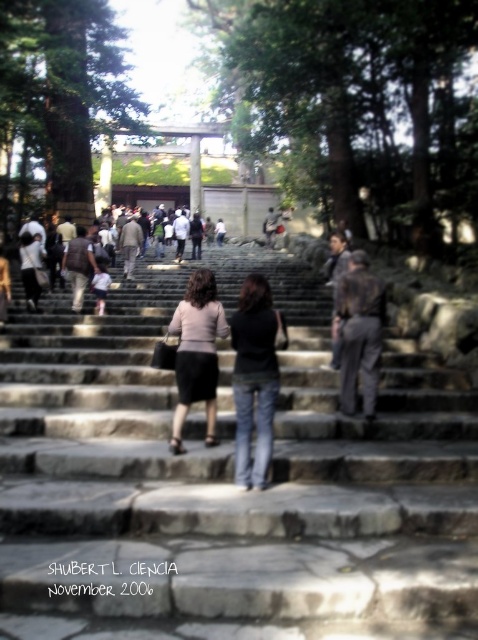
Question: Among these objects, which one is nearest to the camera?

Choices:
 (A) dark gray suit at center
 (B) gray stone stairs at center

Answer: (B)

Question: From the image, what is the correct spatial relationship of gray stone stairs at center in relation to dark gray suit at center?

Choices:
 (A) below
 (B) above

Answer: (A)

Question: Among these objects, which one is nearest to the camera?

Choices:
 (A) matte pink sweater at center
 (B) black denim jeans at center

Answer: (B)

Question: Does matte pink sweater at center have a lesser width compared to dark gray suit at center?

Choices:
 (A) no
 (B) yes

Answer: (A)

Question: Which point is closer to the camera?

Choices:
 (A) matte pink sweater at center
 (B) dark gray suit at center

Answer: (A)

Question: Is gray stone stairs at center to the right of dark gray suit at center from the viewer's perspective?

Choices:
 (A) no
 (B) yes

Answer: (A)